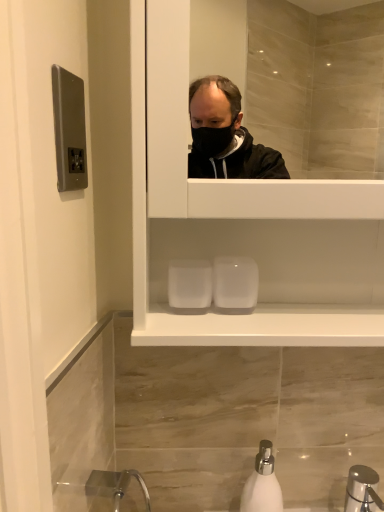
Find the location of a particular element. The height and width of the screenshot is (512, 384). satin nickel switchplate at upper left is located at coordinates (69, 130).

In order to face satin nickel switchplate at upper left, should I rotate leftwards or rightwards?

Turn left approximately 16.167 degrees to face it.

The height and width of the screenshot is (512, 384). What do you see at coordinates (69, 130) in the screenshot? I see `satin nickel switchplate at upper left` at bounding box center [69, 130].

You are a GUI agent. You are given a task and a screenshot of the screen. Output one action in this format:
    pyautogui.click(x=<x>, y=<y>)
    Task: Click on the white matte soap dispenser at lower center
    This screenshot has width=384, height=512.
    Given the screenshot: What is the action you would take?
    pyautogui.click(x=262, y=483)

Describe the element at coordinates (262, 483) in the screenshot. I see `white matte soap dispenser at lower center` at that location.

You are a GUI agent. You are given a task and a screenshot of the screen. Output one action in this format:
    pyautogui.click(x=<x>, y=<y>)
    Task: Click on the satin nickel switchplate at upper left
    This screenshot has height=512, width=384.
    Given the screenshot: What is the action you would take?
    pyautogui.click(x=69, y=130)

Looking at this image, is satin nickel switchplate at upper left at the right side of white matte soap dispenser at lower center?

In fact, satin nickel switchplate at upper left is to the left of white matte soap dispenser at lower center.

Considering the positions of objects satin nickel switchplate at upper left and white matte soap dispenser at lower center in the image provided, who is behind, satin nickel switchplate at upper left or white matte soap dispenser at lower center?

Positioned behind is white matte soap dispenser at lower center.

Does point (67, 83) appear closer or farther from the camera than point (258, 476)?

Point (67, 83).

From the image's perspective, is satin nickel switchplate at upper left located above or below white matte soap dispenser at lower center?

Clearly, from the image's perspective, satin nickel switchplate at upper left is above white matte soap dispenser at lower center.

From a real-world perspective, is satin nickel switchplate at upper left above or below white matte soap dispenser at lower center?

satin nickel switchplate at upper left is situated higher than white matte soap dispenser at lower center in the real world.

Looking at this image, in terms of width, does satin nickel switchplate at upper left look wider or thinner when compared to white matte soap dispenser at lower center?

Considering their sizes, satin nickel switchplate at upper left looks slimmer than white matte soap dispenser at lower center.

Who is shorter, satin nickel switchplate at upper left or white matte soap dispenser at lower center?

Standing shorter between the two is satin nickel switchplate at upper left.

Is satin nickel switchplate at upper left smaller than white matte soap dispenser at lower center?

Indeed, satin nickel switchplate at upper left has a smaller size compared to white matte soap dispenser at lower center.

Is satin nickel switchplate at upper left located outside white matte soap dispenser at lower center?

Absolutely, satin nickel switchplate at upper left is external to white matte soap dispenser at lower center.

Does satin nickel switchplate at upper left touch white matte soap dispenser at lower center?

No, satin nickel switchplate at upper left is not making contact with white matte soap dispenser at lower center.

Is satin nickel switchplate at upper left positioned with its back to white matte soap dispenser at lower center?

No.

From the picture: How different are the orientations of satin nickel switchplate at upper left and white matte soap dispenser at lower center in degrees?

84.1 degrees separate the facing orientations of satin nickel switchplate at upper left and white matte soap dispenser at lower center.

Find the location of a particular element. soap dispenser below the satin nickel switchplate at upper left (from the image's perspective) is located at coordinates (262, 483).

Considering the positions of objects white matte soap dispenser at lower center and satin nickel switchplate at upper left in the image provided, who is more to the right, white matte soap dispenser at lower center or satin nickel switchplate at upper left?

Positioned to the right is white matte soap dispenser at lower center.

Which object is further away from the camera, white matte soap dispenser at lower center or satin nickel switchplate at upper left?

white matte soap dispenser at lower center.

Which is in front, point (276, 479) or point (72, 76)?

The point (72, 76) is in front.

From the image's perspective, is white matte soap dispenser at lower center located beneath satin nickel switchplate at upper left?

Indeed, from the image's perspective, white matte soap dispenser at lower center is shown beneath satin nickel switchplate at upper left.

From a real-world perspective, relative to satin nickel switchplate at upper left, is white matte soap dispenser at lower center vertically above or below?

Clearly, from a real-world perspective, white matte soap dispenser at lower center is below satin nickel switchplate at upper left.

In terms of width, does white matte soap dispenser at lower center look wider or thinner when compared to satin nickel switchplate at upper left?

In the image, white matte soap dispenser at lower center appears to be wider than satin nickel switchplate at upper left.

Between white matte soap dispenser at lower center and satin nickel switchplate at upper left, which one has more height?

white matte soap dispenser at lower center is taller.

Is white matte soap dispenser at lower center smaller than satin nickel switchplate at upper left?

Actually, white matte soap dispenser at lower center might be larger than satin nickel switchplate at upper left.

Do you think white matte soap dispenser at lower center is within satin nickel switchplate at upper left, or outside of it?

white matte soap dispenser at lower center is spatially situated outside satin nickel switchplate at upper left.

Is white matte soap dispenser at lower center directly adjacent to satin nickel switchplate at upper left?

No, white matte soap dispenser at lower center is not making contact with satin nickel switchplate at upper left.

Could you tell me if white matte soap dispenser at lower center is facing satin nickel switchplate at upper left?

No, white matte soap dispenser at lower center is not facing towards satin nickel switchplate at upper left.

The image size is (384, 512). In order to click on door handle that appears on the left of white matte soap dispenser at lower center in this screenshot , I will do `click(69, 130)`.

Where is `soap dispenser located on the right of satin nickel switchplate at upper left`? This screenshot has height=512, width=384. soap dispenser located on the right of satin nickel switchplate at upper left is located at coordinates (262, 483).

You are a GUI agent. You are given a task and a screenshot of the screen. Output one action in this format:
    pyautogui.click(x=<x>, y=<y>)
    Task: Click on the door handle above the white matte soap dispenser at lower center (from a real-world perspective)
    Image resolution: width=384 pixels, height=512 pixels.
    Given the screenshot: What is the action you would take?
    pyautogui.click(x=69, y=130)